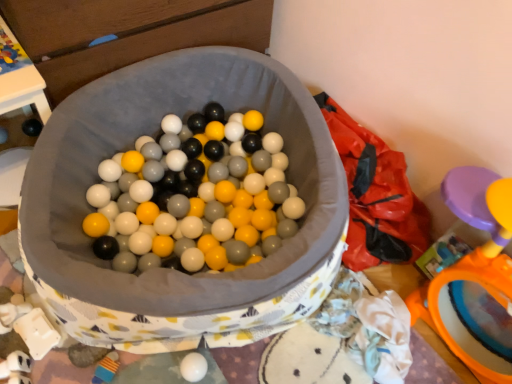
At what (x,y) coordinates should I click in order to perform the action: click on white matte egg at center. Please return your answer as a coordinate pair (x, y). The image size is (512, 384). Looking at the image, I should click on (193, 367).

Describe the element at coordinates (193, 367) in the screenshot. The width and height of the screenshot is (512, 384). I see `white matte egg at center` at that location.

Where is `white matte egg at center`? white matte egg at center is located at coordinates (193, 367).